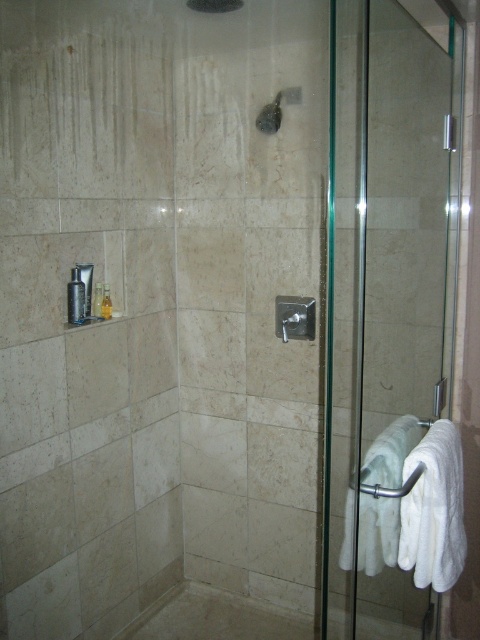
Does transparent glass door at right come in front of beige marble bath at lower center?

Yes, transparent glass door at right is in front of beige marble bath at lower center.

Can you confirm if transparent glass door at right is bigger than beige marble bath at lower center?

Yes.

Which is in front, point (395, 209) or point (147, 627)?

Positioned in front is point (395, 209).

The image size is (480, 640). Find the location of `transparent glass door at right`. transparent glass door at right is located at coordinates (383, 298).

Does transparent glass door at right have a greater height compared to matte black soap dispenser at upper center?

Correct, transparent glass door at right is much taller as matte black soap dispenser at upper center.

Does point (440, 385) come in front of point (266, 115)?

Yes.

Identify the location of transparent glass door at right. (383, 298).

Between point (228, 605) and point (271, 132), which one is positioned in front?

Point (271, 132)

Which is in front, point (308, 637) or point (263, 131)?

Point (263, 131) is more forward.

This screenshot has height=640, width=480. I want to click on beige marble bath at lower center, so click(x=216, y=618).